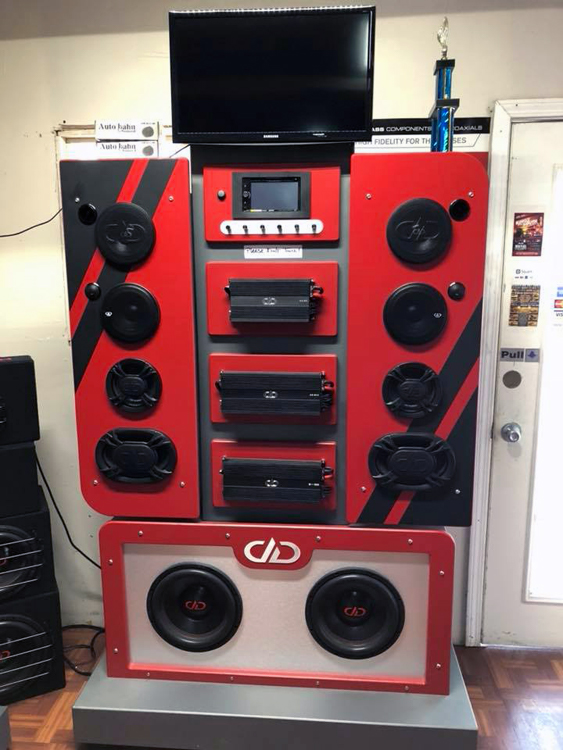
Identify the location of doorframe. The height and width of the screenshot is (750, 563). (481, 504).